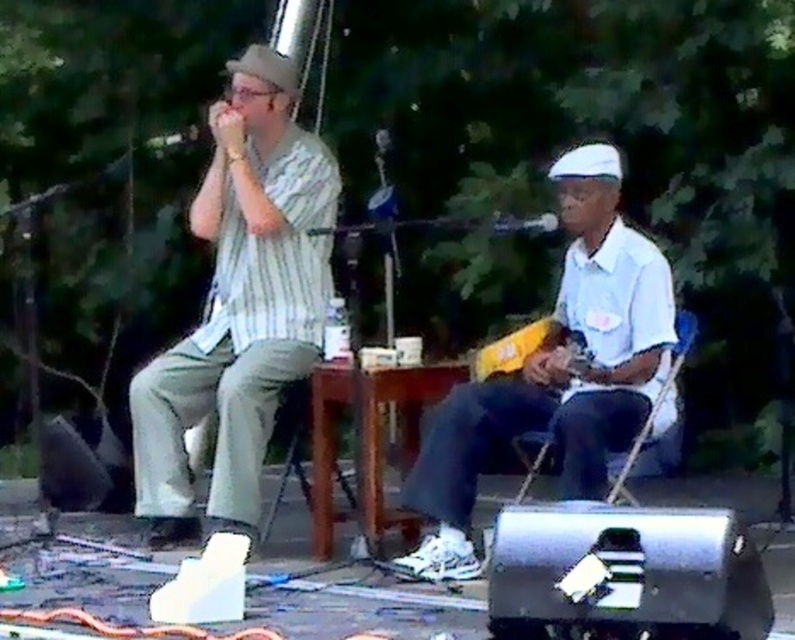
Is point (200, 209) positioned before point (543, 404)?

That is False.

Does striped cotton shirt at center have a larger size compared to white matte shirt at center?

Correct, striped cotton shirt at center is larger in size than white matte shirt at center.

Which is behind, point (251, 232) or point (580, 333)?

The point (251, 232) is behind.

Where is `striped cotton shirt at center`? This screenshot has height=640, width=795. striped cotton shirt at center is located at coordinates (239, 304).